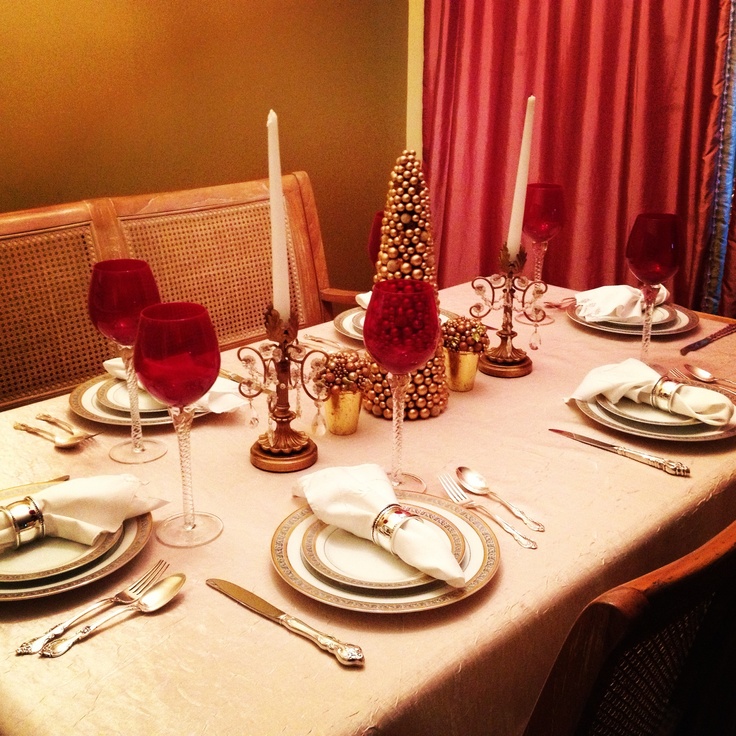
Where is `napkin`? napkin is located at coordinates (431, 561), (90, 520), (219, 406), (361, 299), (595, 299), (626, 372).